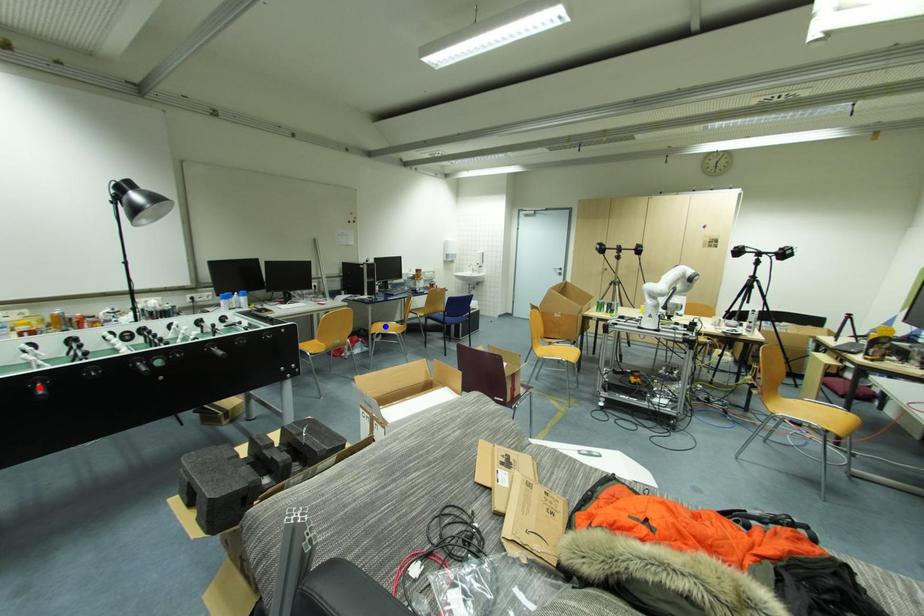
Question: In the image, two points are highlighted. Which point is nearer to the camera? Reply with the corresponding letter.

Choices:
 (A) blue point
 (B) red point

Answer: (B)